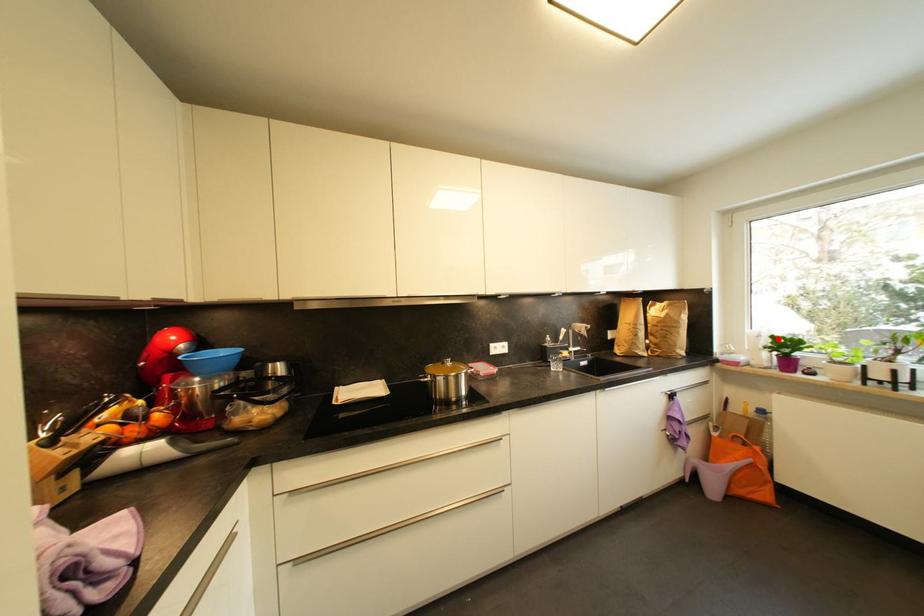
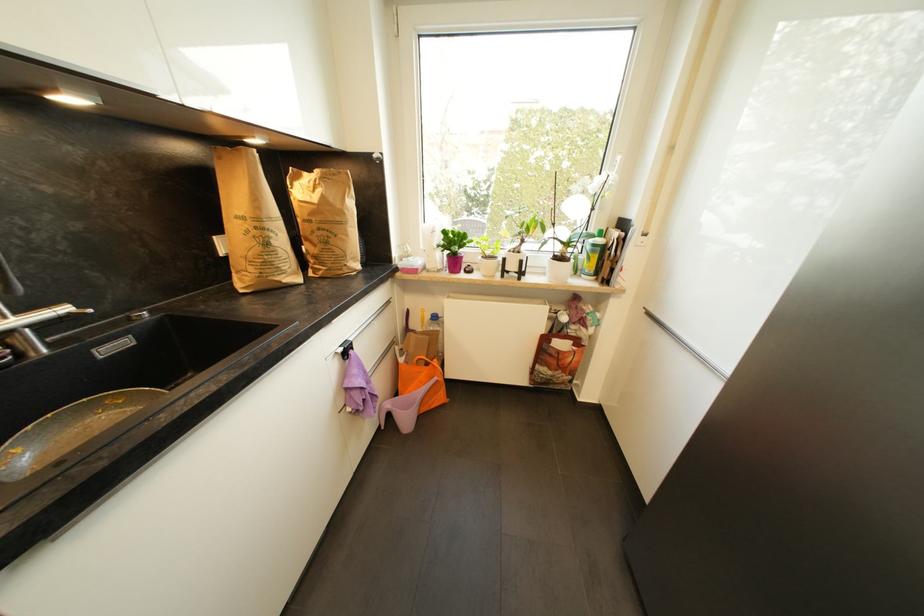
In the second image, find the point that corresponds to the highlighted location in the first image.

(450, 233)